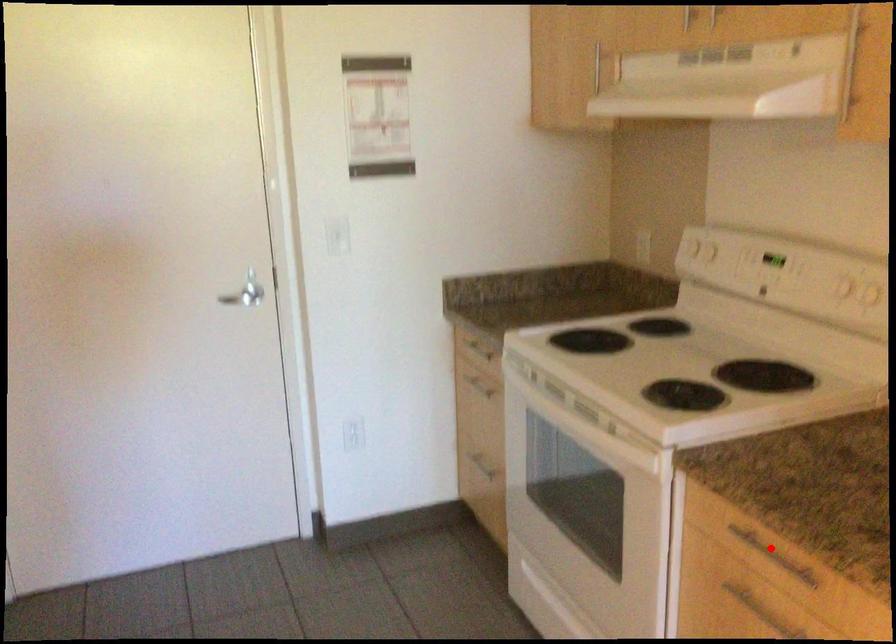
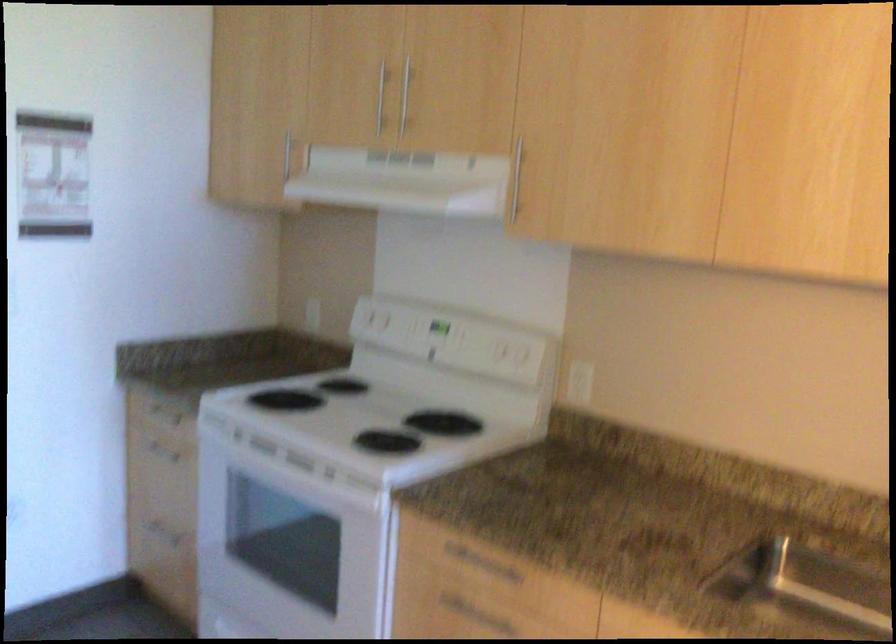
Question: I am providing you with two images of the same scene from different viewpoints. In image1, a red point is highlighted. Considering the same 3D point in image2, which of the following is correct?

Choices:
 (A) It is closer
 (B) It is farther

Answer: (B)